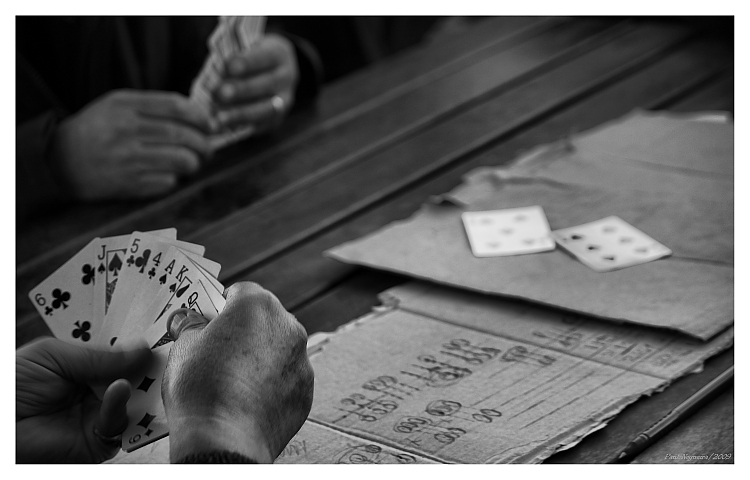
Where is `table`? table is located at coordinates (322, 196).